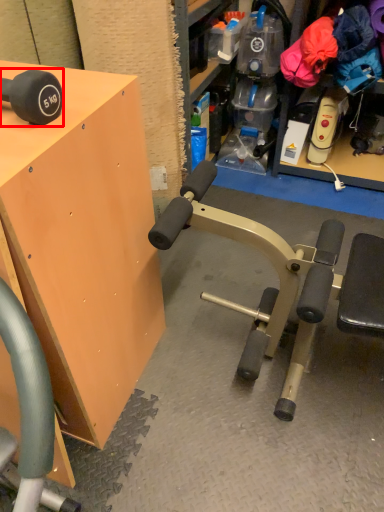
Question: From the image's perspective, where is dumbbell (annotated by the red box) located relative to table?

Choices:
 (A) below
 (B) above

Answer: (B)